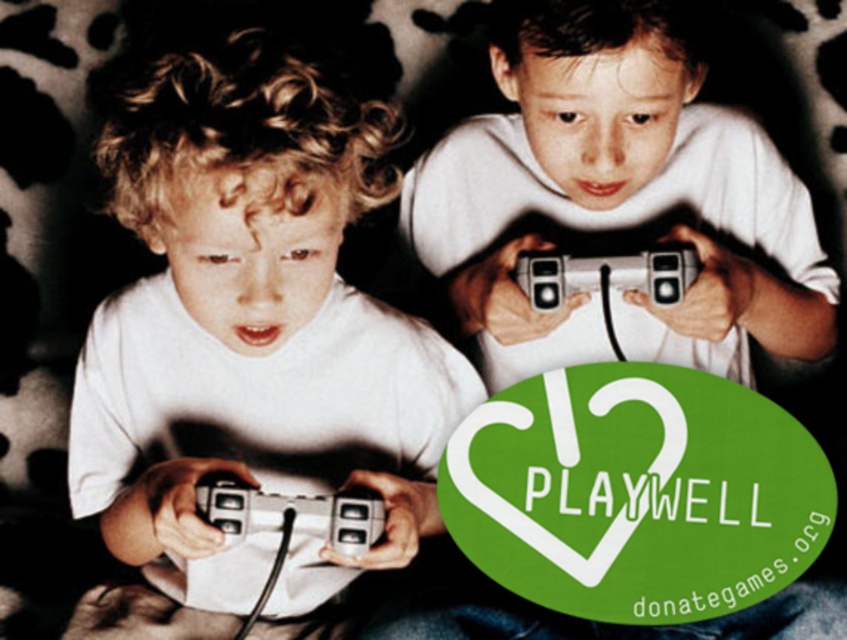
You are a photographer trying to capture a candid shot of the two children playing video games. The children are positioned at point (284, 275). If your camera has a focal length of 50mm and you want to ensure both children are in focus, what is the minimum distance you should maintain from the children to achieve this?

The children are 33.72 inches apart. To ensure both are in focus with a 50mm lens, the minimum distance should be at least 4 times the distance between them, so approximately 134.88 inches away.

You are a photographer trying to capture a closeup of the metallic silver game controller at lower center. However, the matte white shirt at center is blocking your view. Can you adjust your position to focus on the game controller without moving the shirt?

The matte white shirt at center is closer to the viewer than the metallic silver game controller at lower center. Therefore, you cannot adjust your position to focus on the game controller without moving the shirt, as it is obstructed by the shirt being in front of it.